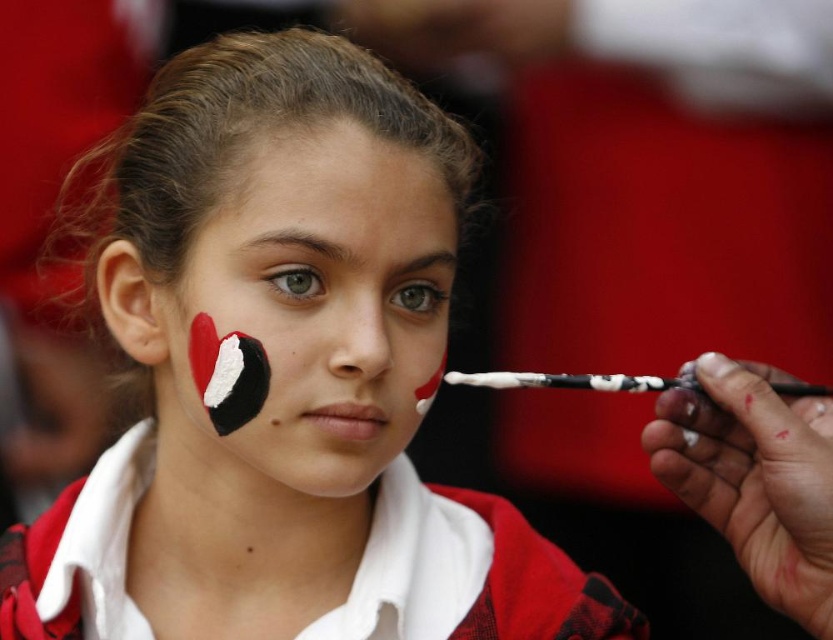
You are an artist applying face paint to a client. You have two colors available, matte black face paint at center and white matte paint at center. Which color has a larger area painted on the client?

The matte black face paint at center is bigger than white matte paint at center, so the matte black face paint at center has a larger area painted on the client.

What color is the face paint at the coordinates point [283,378]?

The point [283,378] corresponds to matte black face paint at center.